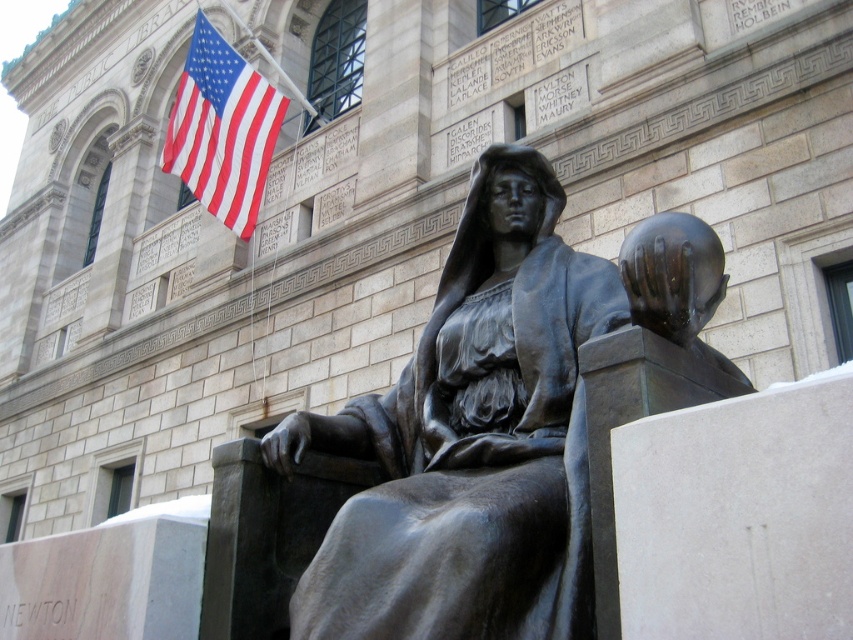
You are standing in front of the library and want to take a photo of the statue. You notice two points on the statue labeled as point (384, 577) and point (256, 216). Which point will appear larger in your camera view?

Point (384, 577) is closer to the camera than point (256, 216), so it will appear larger in the camera view.